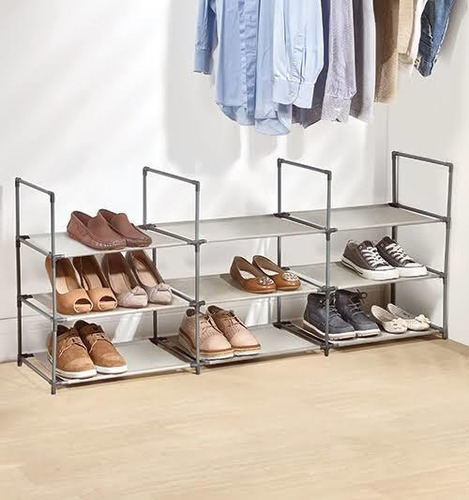
Where is `shoes on bottom shelf`? shoes on bottom shelf is located at coordinates (70, 353), (106, 356), (221, 343), (245, 343), (348, 333), (368, 333), (406, 324), (421, 326).